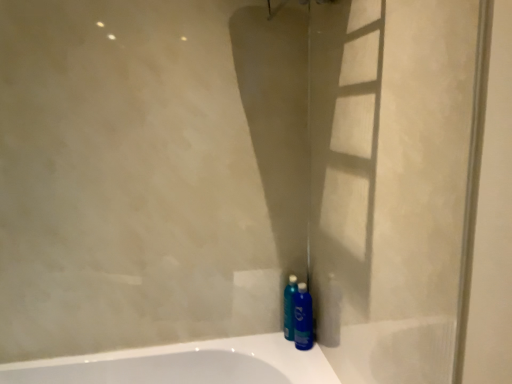
Question: Is blue glossy bottle at lower right to the right of metallic blue spray bottle at lower right from the viewer's perspective?

Choices:
 (A) no
 (B) yes

Answer: (B)

Question: Can you confirm if blue glossy bottle at lower right is taller than metallic blue spray bottle at lower right?

Choices:
 (A) no
 (B) yes

Answer: (A)

Question: Can you confirm if blue glossy bottle at lower right is thinner than metallic blue spray bottle at lower right?

Choices:
 (A) no
 (B) yes

Answer: (A)

Question: Could you tell me if blue glossy bottle at lower right is turned towards metallic blue spray bottle at lower right?

Choices:
 (A) no
 (B) yes

Answer: (A)

Question: Can you confirm if blue glossy bottle at lower right is smaller than metallic blue spray bottle at lower right?

Choices:
 (A) no
 (B) yes

Answer: (A)

Question: Is blue glossy bottle at lower right completely or partially outside of metallic blue spray bottle at lower right?

Choices:
 (A) yes
 (B) no

Answer: (A)

Question: Is metallic blue spray bottle at lower right closer to the viewer compared to blue glossy bottle at lower right?

Choices:
 (A) no
 (B) yes

Answer: (A)

Question: Can you confirm if metallic blue spray bottle at lower right is positioned to the right of blue glossy bottle at lower right?

Choices:
 (A) yes
 (B) no

Answer: (B)

Question: Does metallic blue spray bottle at lower right have a larger size compared to blue glossy bottle at lower right?

Choices:
 (A) no
 (B) yes

Answer: (A)

Question: Considering the relative sizes of metallic blue spray bottle at lower right and blue glossy bottle at lower right in the image provided, is metallic blue spray bottle at lower right thinner than blue glossy bottle at lower right?

Choices:
 (A) no
 (B) yes

Answer: (B)

Question: Can you confirm if metallic blue spray bottle at lower right is wider than blue glossy bottle at lower right?

Choices:
 (A) no
 (B) yes

Answer: (A)

Question: From the image's perspective, is metallic blue spray bottle at lower right on top of blue glossy bottle at lower right?

Choices:
 (A) yes
 (B) no

Answer: (A)

Question: From the image's perspective, is metallic blue spray bottle at lower right above or below blue glossy bottle at lower right?

Choices:
 (A) above
 (B) below

Answer: (A)